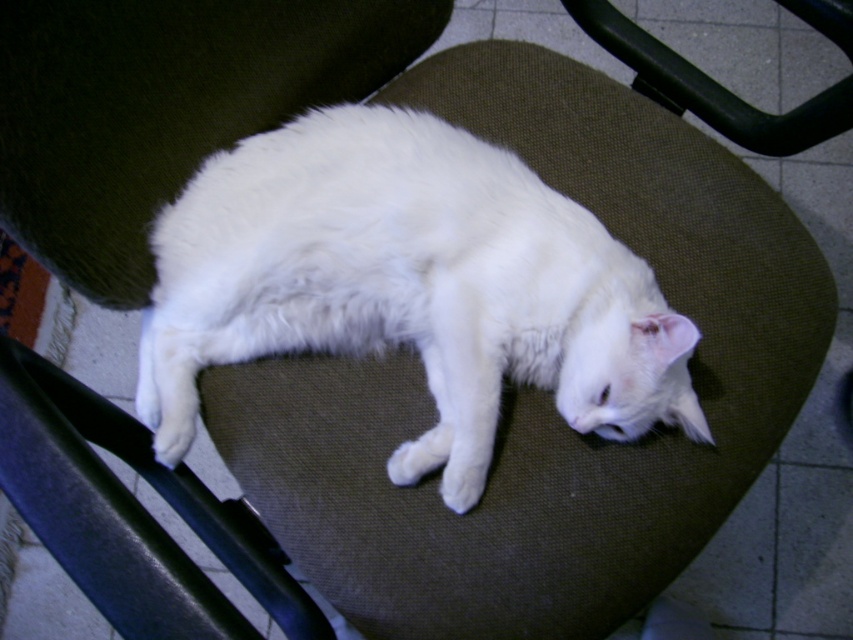
Question: In this image, where is white fluffy cat at center located relative to black plastic swivel chair at upper right?

Choices:
 (A) right
 (B) left

Answer: (B)

Question: Can you confirm if white fluffy cat at center is positioned to the left of black plastic swivel chair at upper right?

Choices:
 (A) no
 (B) yes

Answer: (B)

Question: Can you confirm if white fluffy cat at center is wider than black plastic swivel chair at upper right?

Choices:
 (A) yes
 (B) no

Answer: (A)

Question: Which object appears closest to the camera in this image?

Choices:
 (A) black plastic swivel chair at upper right
 (B) white fluffy cat at center

Answer: (B)

Question: Which point is closer to the camera?

Choices:
 (A) (650, 314)
 (B) (834, 20)

Answer: (A)